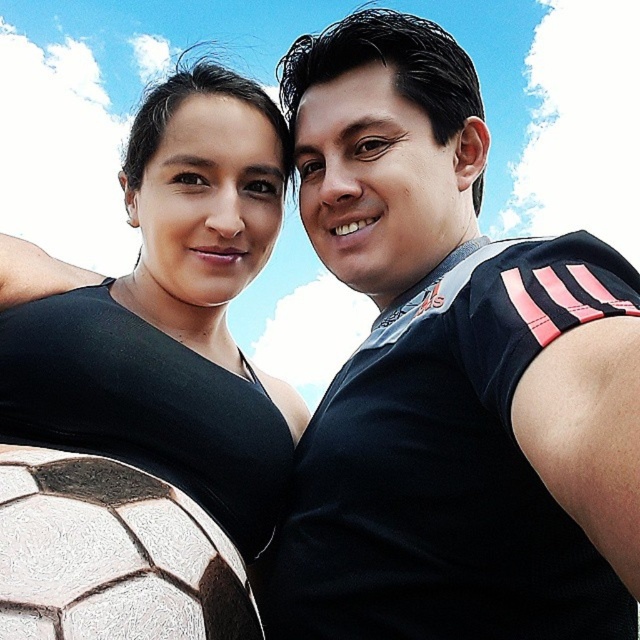
Question: Is black matte jersey at center positioned behind matte black dress at center?

Choices:
 (A) yes
 (B) no

Answer: (B)

Question: Is black matte jersey at center above matte black dress at center?

Choices:
 (A) yes
 (B) no

Answer: (A)

Question: Can you confirm if black matte jersey at center is positioned to the left of matte black dress at center?

Choices:
 (A) yes
 (B) no

Answer: (B)

Question: Which point is closer to the camera taking this photo?

Choices:
 (A) (195, 410)
 (B) (390, 564)

Answer: (B)